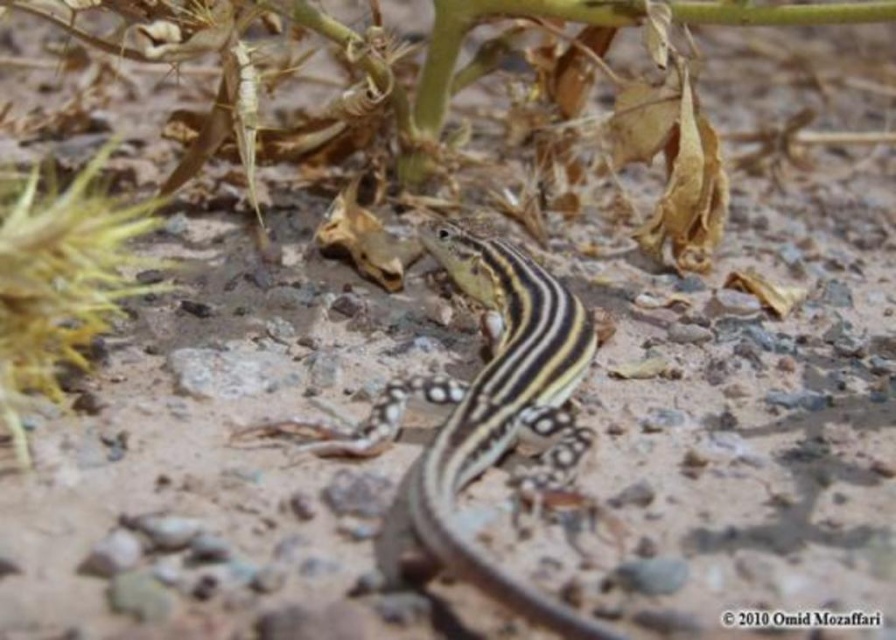
Question: Among these objects, which one is farthest from the camera?

Choices:
 (A) yellow striped lizard at center
 (B) yellow fuzzy plant at left

Answer: (B)

Question: Which of the following is the farthest from the observer?

Choices:
 (A) yellow fuzzy plant at left
 (B) yellow striped lizard at center

Answer: (A)

Question: Does yellow striped lizard at center come in front of yellow fuzzy plant at left?

Choices:
 (A) no
 (B) yes

Answer: (B)

Question: Does yellow striped lizard at center have a lesser width compared to yellow fuzzy plant at left?

Choices:
 (A) yes
 (B) no

Answer: (A)

Question: Among these objects, which one is nearest to the camera?

Choices:
 (A) yellow striped lizard at center
 (B) yellow fuzzy plant at left

Answer: (A)

Question: Is yellow striped lizard at center further to camera compared to yellow fuzzy plant at left?

Choices:
 (A) yes
 (B) no

Answer: (B)